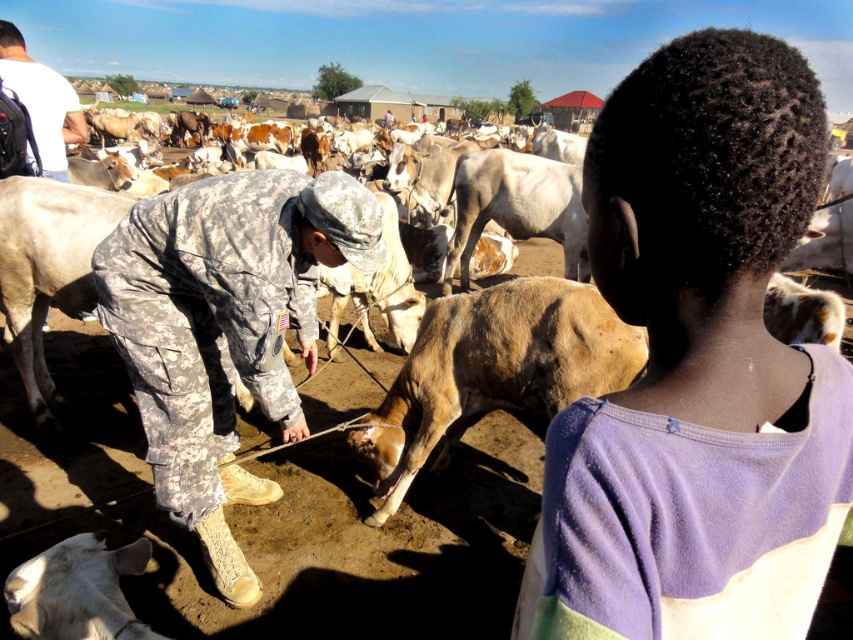
Question: Is brown rough cow at center positioned at the back of white matte cow at lower left?

Choices:
 (A) yes
 (B) no

Answer: (A)

Question: Among these points, which one is nearest to the camera?

Choices:
 (A) (93, 589)
 (B) (397, 467)
 (C) (776, 259)
 (D) (1, 74)

Answer: (C)

Question: Is purple cotton shirt at upper right to the left of white matte cow at lower left from the viewer's perspective?

Choices:
 (A) no
 (B) yes

Answer: (A)

Question: Does brown rough cow at center appear on the left side of white matte shirt at upper left?

Choices:
 (A) no
 (B) yes

Answer: (A)

Question: Among these objects, which one is nearest to the camera?

Choices:
 (A) purple cotton shirt at upper right
 (B) white matte cow at lower left
 (C) brown rough cow at center
 (D) camouflage fabric soldier at center

Answer: (A)

Question: Which of the following is the closest to the observer?

Choices:
 (A) (300, 257)
 (B) (119, 627)

Answer: (B)